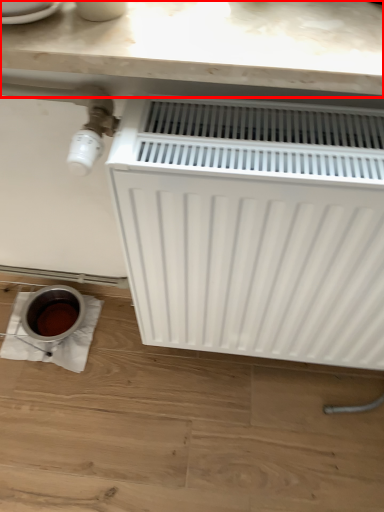
Question: Where is counter top (annotated by the red box) located in relation to radiator in the image?

Choices:
 (A) right
 (B) left

Answer: (B)